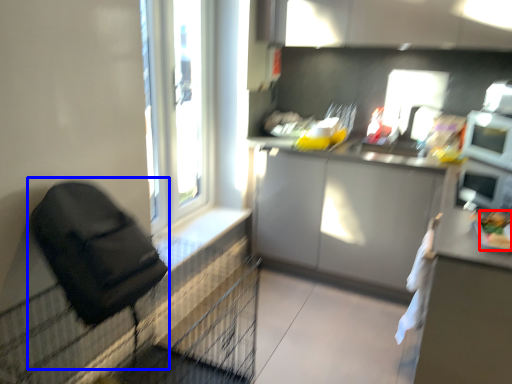
Question: Which object is closer to the camera taking this photo, food (highlighted by a red box) or feeding chair (highlighted by a blue box)?

Choices:
 (A) food
 (B) feeding chair

Answer: (B)